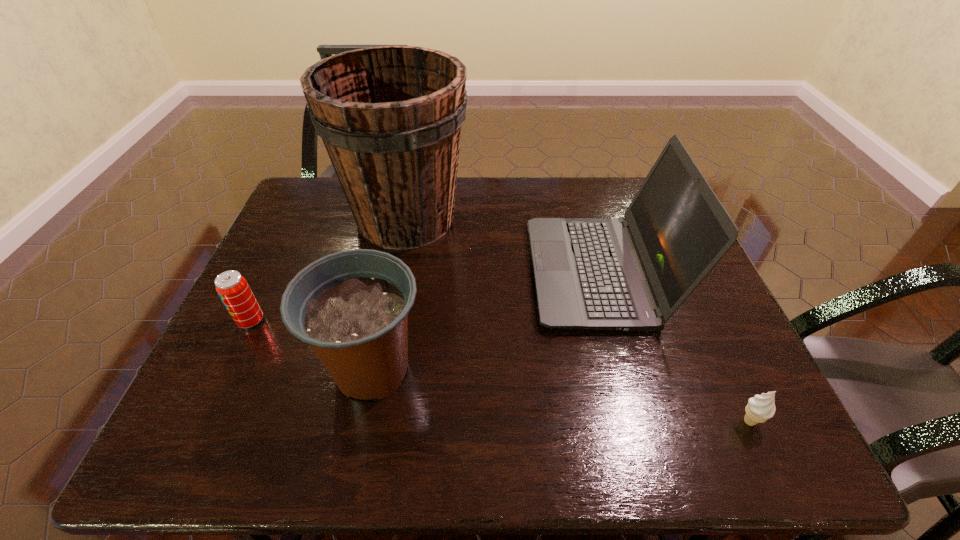
At what (x,y) coordinates should I click in order to perform the action: click on bucket. Please return your answer as a coordinate pair (x, y). Looking at the image, I should click on (390, 117).

Find the location of `the fourth object from left to right`. the fourth object from left to right is located at coordinates (631, 273).

Where is `laptop_computer`? Image resolution: width=960 pixels, height=540 pixels. laptop_computer is located at coordinates (631, 273).

Where is `the third tallest object`? The width and height of the screenshot is (960, 540). the third tallest object is located at coordinates (352, 307).

Find the location of a particular element. the fourth tallest object is located at coordinates (233, 289).

Where is `the leftmost object`? the leftmost object is located at coordinates (233, 289).

Locate an element on the screen. Image resolution: width=960 pixels, height=540 pixels. icecream is located at coordinates (760, 408).

Find the location of a particular element. the rightmost object is located at coordinates (760, 408).

Identify the location of blank space located 0.090m on the right of the bucket. (499, 219).

Where is `vacant region located on the screen of the second object from right to left`? Image resolution: width=960 pixels, height=540 pixels. vacant region located on the screen of the second object from right to left is located at coordinates (435, 273).